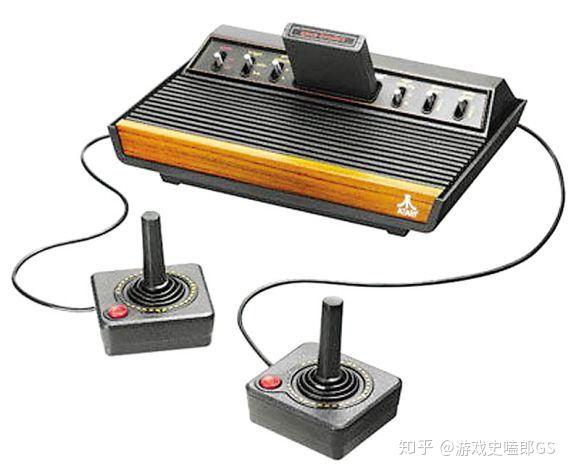
This screenshot has width=570, height=473. I want to click on switches, so click(218, 62), click(253, 63), click(272, 69), click(394, 97), click(431, 97), click(458, 104).